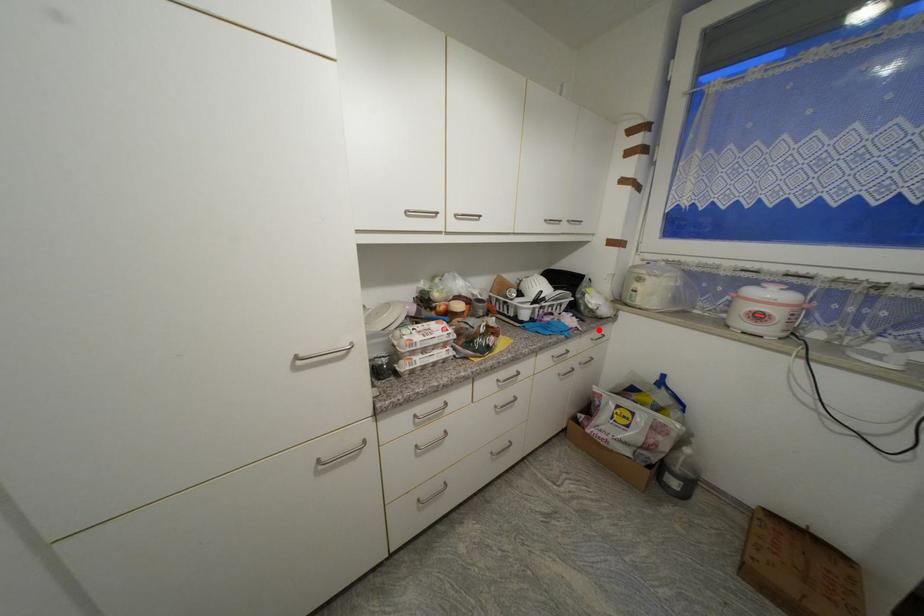
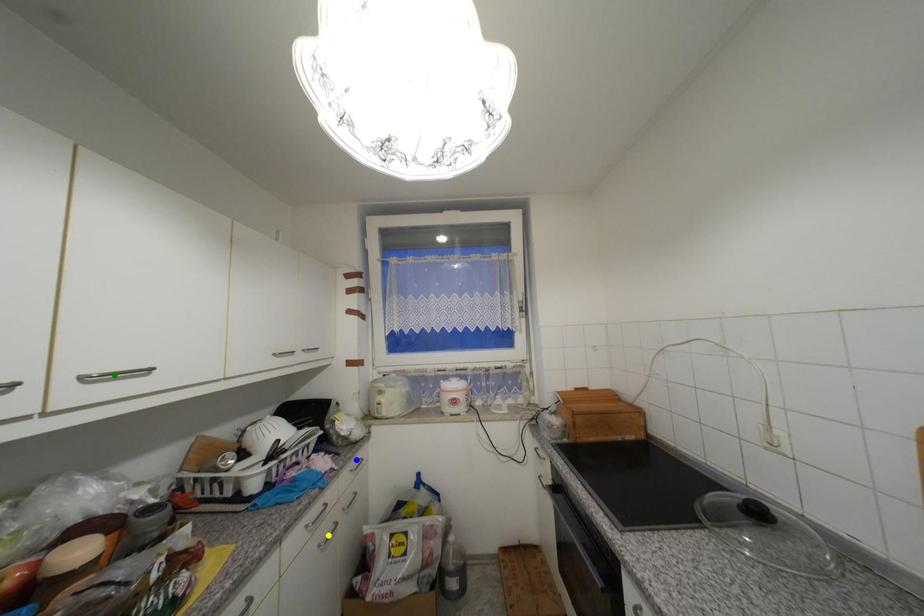
Question: I am providing you with two images of the same scene from different viewpoints. A red point is marked on the first image. You are given multiple points on the second image. Which point in image 2 is actually the same real-world point as the red point in image 1?

Choices:
 (A) yellow point
 (B) blue point
 (C) green point

Answer: (B)